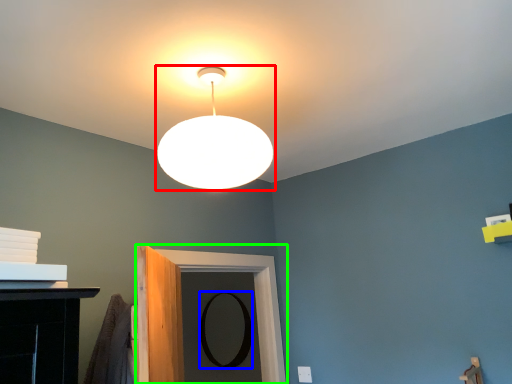
Question: Which is nearer to the lamp (highlighted by a red box)? mirror (highlighted by a blue box) or door (highlighted by a green box).

Choices:
 (A) mirror
 (B) door

Answer: (B)